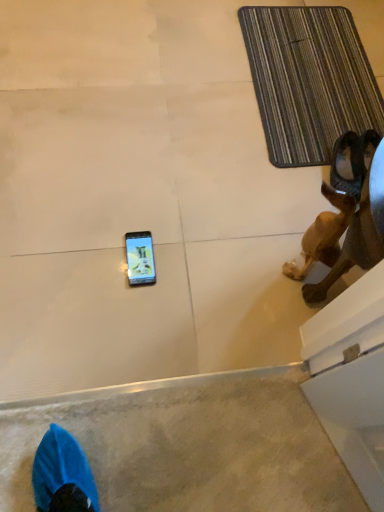
The height and width of the screenshot is (512, 384). I want to click on vacant space to the left of brown leather dog at lower right, so click(x=251, y=253).